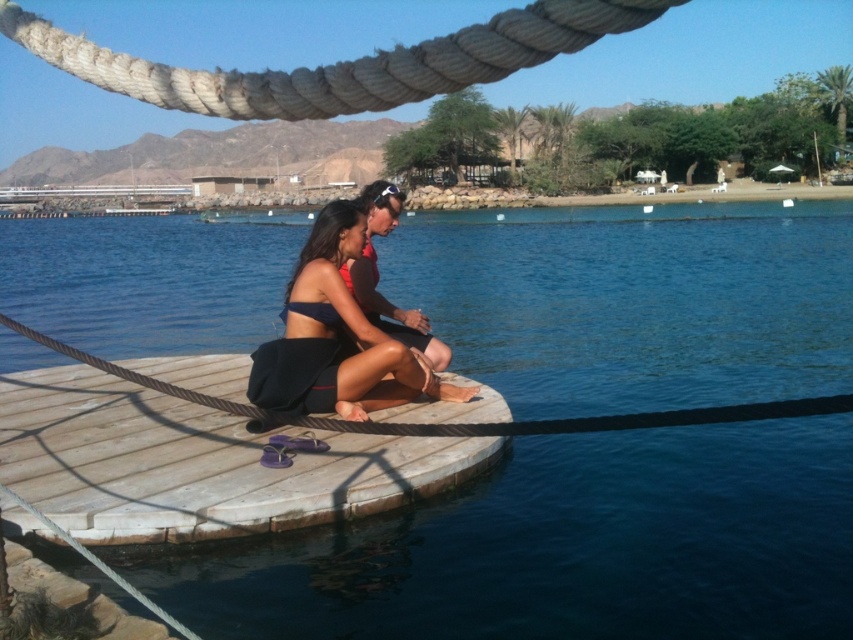
Question: Which point is farther from the camera taking this photo?

Choices:
 (A) (465, 460)
 (B) (850, 396)

Answer: (B)

Question: Does rope at center appear on the left side of matte black shorts at center?

Choices:
 (A) no
 (B) yes

Answer: (A)

Question: Can you confirm if wooden dock at center is bigger than matte black shorts at center?

Choices:
 (A) no
 (B) yes

Answer: (A)

Question: Which object appears closest to the camera in this image?

Choices:
 (A) matte black bikini top at center
 (B) wooden dock at center
 (C) rope at center
 (D) matte black shorts at center

Answer: (C)

Question: Which point is closer to the camera?

Choices:
 (A) rope at center
 (B) blue water at center
 (C) matte black bikini top at center
 (D) wooden dock at center

Answer: (A)

Question: Can you confirm if wooden dock at center is positioned to the left of matte black shorts at center?

Choices:
 (A) no
 (B) yes

Answer: (B)